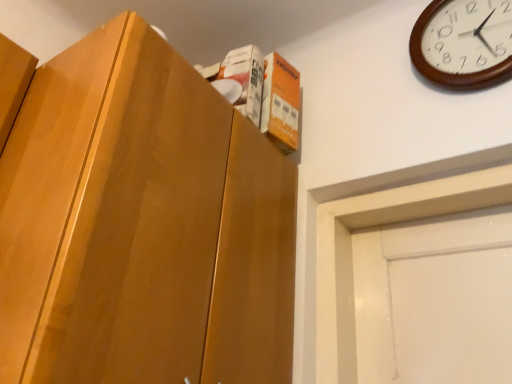
Question: From the image's perspective, does matte wood cabinet at upper left appear lower than wooden clock at upper right?

Choices:
 (A) yes
 (B) no

Answer: (A)

Question: Is matte wood cabinet at upper left far away from wooden clock at upper right?

Choices:
 (A) no
 (B) yes

Answer: (A)

Question: Does matte wood cabinet at upper left appear on the right side of wooden clock at upper right?

Choices:
 (A) yes
 (B) no

Answer: (B)

Question: Is matte wood cabinet at upper left bigger than wooden clock at upper right?

Choices:
 (A) no
 (B) yes

Answer: (B)

Question: Can you confirm if matte wood cabinet at upper left is thinner than wooden clock at upper right?

Choices:
 (A) no
 (B) yes

Answer: (A)

Question: From a real-world perspective, does matte wood cabinet at upper left stand above wooden clock at upper right?

Choices:
 (A) no
 (B) yes

Answer: (A)

Question: From the image's perspective, would you say wooden clock at upper right is positioned over matte wood cabinet at upper left?

Choices:
 (A) yes
 (B) no

Answer: (A)

Question: Is wooden clock at upper right with matte wood cabinet at upper left?

Choices:
 (A) no
 (B) yes

Answer: (A)

Question: Considering the relative sizes of wooden clock at upper right and matte wood cabinet at upper left in the image provided, is wooden clock at upper right smaller than matte wood cabinet at upper left?

Choices:
 (A) yes
 (B) no

Answer: (A)

Question: Does wooden clock at upper right have a lesser width compared to matte wood cabinet at upper left?

Choices:
 (A) no
 (B) yes

Answer: (B)

Question: Could matte wood cabinet at upper left be considered to be inside wooden clock at upper right?

Choices:
 (A) no
 (B) yes

Answer: (A)

Question: Can you confirm if wooden clock at upper right is wider than matte wood cabinet at upper left?

Choices:
 (A) no
 (B) yes

Answer: (A)

Question: Is point (464, 46) closer or farther from the camera than point (18, 165)?

Choices:
 (A) farther
 (B) closer

Answer: (A)